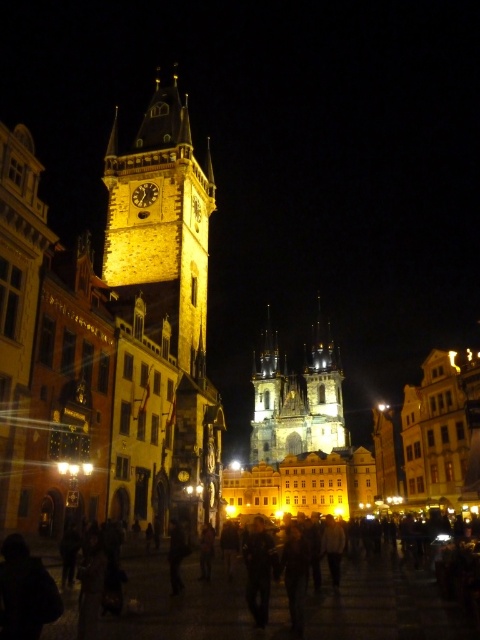
Question: Does dark clothing crowd at center appear over golden stone clock tower at center?

Choices:
 (A) yes
 (B) no

Answer: (B)

Question: Does dark clothing crowd at center appear on the right side of golden stone clock tower at center?

Choices:
 (A) no
 (B) yes

Answer: (B)

Question: Which object is positioned farthest from the golden stone clock tower at center?

Choices:
 (A) dark clothing crowd at center
 (B) golden stone cathedral at center

Answer: (B)

Question: Does golden stone clock tower at center have a smaller size compared to golden stone cathedral at center?

Choices:
 (A) no
 (B) yes

Answer: (A)

Question: Which object is positioned closest to the golden stone cathedral at center?

Choices:
 (A) golden stone clock tower at center
 (B) dark clothing crowd at center

Answer: (A)

Question: Which of these objects is positioned farthest from the dark clothing crowd at center?

Choices:
 (A) golden stone clock tower at center
 (B) golden stone cathedral at center

Answer: (B)